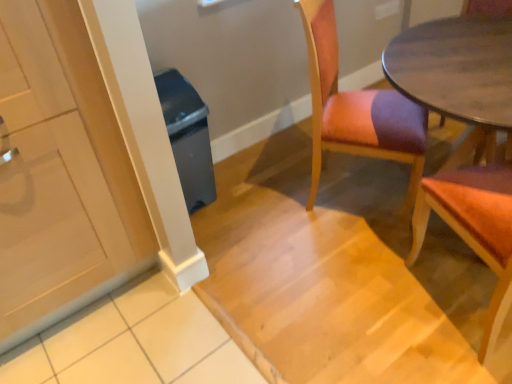
Question: In the image, is gray plastic trash can at left positioned in front of or behind white glossy cabinet at left?

Choices:
 (A) front
 (B) behind

Answer: (B)

Question: From the image's perspective, is gray plastic trash can at left located above or below white glossy cabinet at left?

Choices:
 (A) below
 (B) above

Answer: (B)

Question: Estimate the real-world distances between objects in this image. Which object is farther from the white glossy cabinet at left?

Choices:
 (A) gray plastic trash can at left
 (B) wooden upholstered chair at center, the first chair viewed from the left
 (C) wooden chair at right, arranged as the 2th chair when viewed from the left

Answer: (C)

Question: Based on their relative distances, which object is farther from the wooden upholstered chair at center, acting as the 2th chair starting from the right?

Choices:
 (A) white glossy cabinet at left
 (B) gray plastic trash can at left
 (C) wooden chair at right, marked as the first chair in a right-to-left arrangement

Answer: (A)